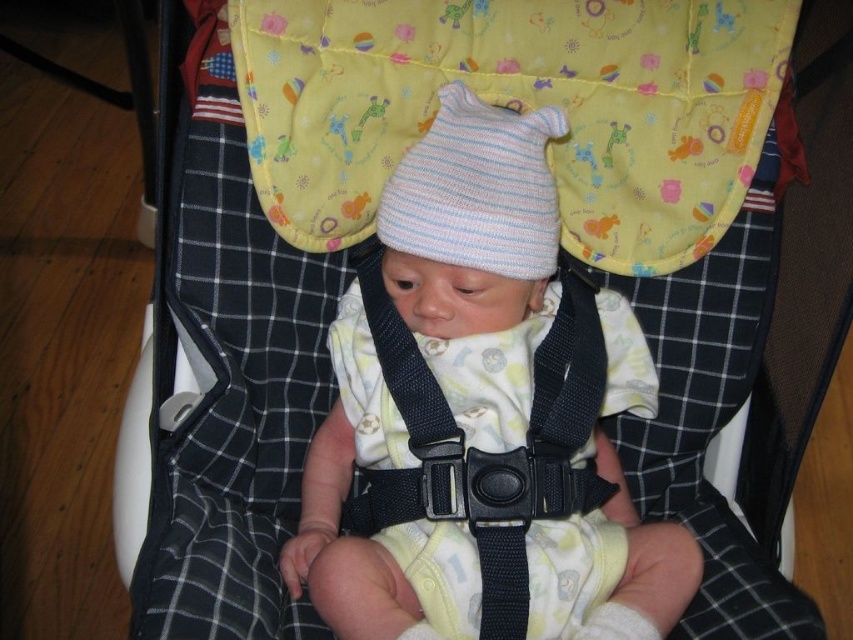
Question: Which object is positioned closest to the striped knit hat at center?

Choices:
 (A) soft cotton hat at center
 (B) black fabric strap at center

Answer: (A)

Question: Is soft cotton hat at center positioned at the back of black fabric strap at center?

Choices:
 (A) no
 (B) yes

Answer: (A)

Question: Does soft cotton hat at center appear over black fabric strap at center?

Choices:
 (A) yes
 (B) no

Answer: (A)

Question: Which point is farther from the camera taking this photo?

Choices:
 (A) (432, 435)
 (B) (357, 284)
 (C) (421, 179)

Answer: (B)

Question: Which point appears farthest from the camera in this image?

Choices:
 (A) (463, 161)
 (B) (581, 300)
 (C) (495, 298)

Answer: (B)

Question: From the image, what is the correct spatial relationship of soft cotton hat at center in relation to striped knit hat at center?

Choices:
 (A) right
 (B) left

Answer: (A)